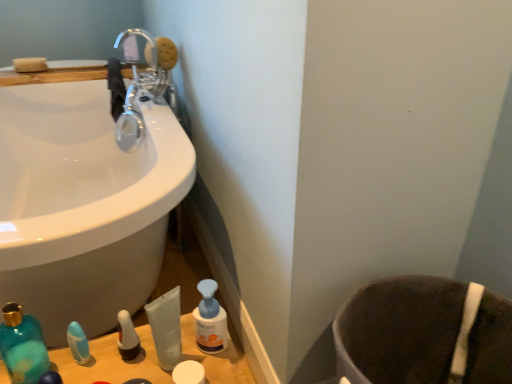
Where is `empty space that is to the right of teal glass mouthwash at lower left`? The height and width of the screenshot is (384, 512). empty space that is to the right of teal glass mouthwash at lower left is located at coordinates (101, 363).